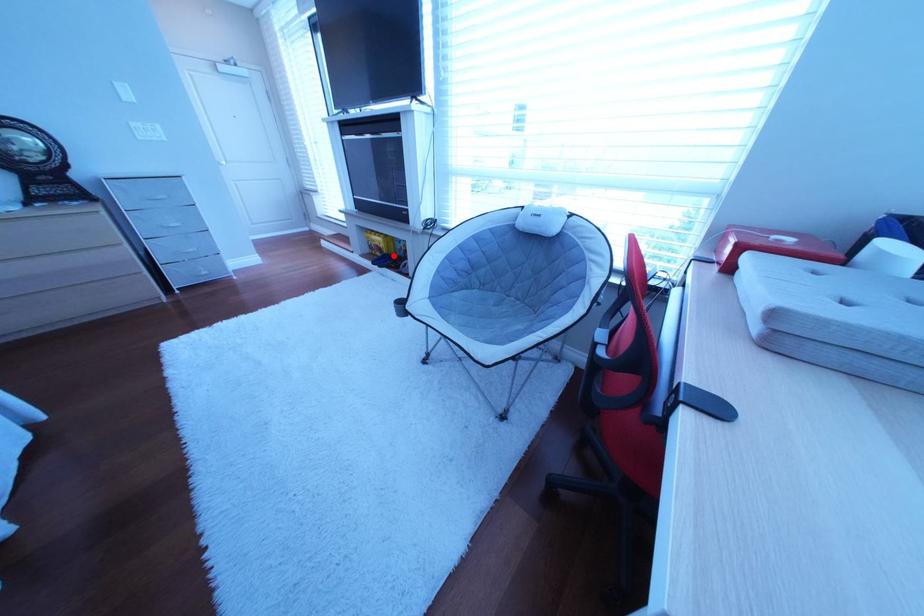
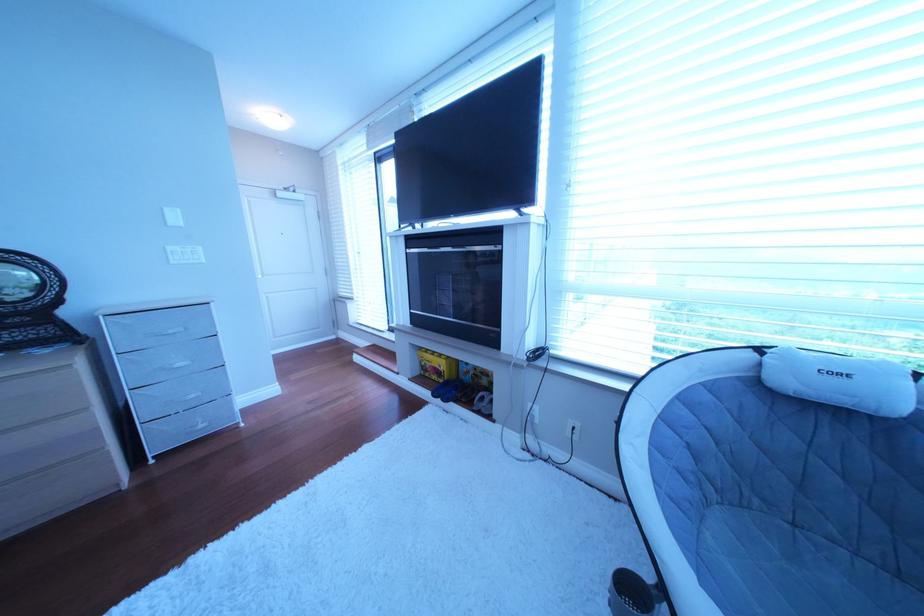
Question: A red point is marked in image1. In image2, is the corresponding 3D point closer to the camera or farther? Reply with the corresponding letter.

Choices:
 (A) The corresponding 3D point is closer.
 (B) The corresponding 3D point is farther.

Answer: (B)